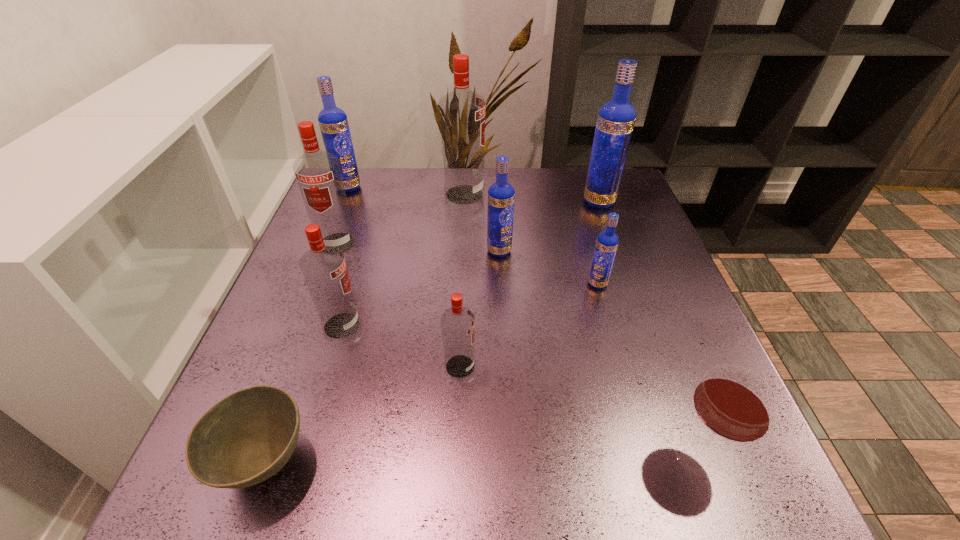
What are the coordinates of `the third nearest vodka` in the screenshot? It's located at (607, 242).

Where is `the nearest red vodka`? This screenshot has width=960, height=540. the nearest red vodka is located at coordinates (457, 322).

Locate an element on the screen. This screenshot has width=960, height=540. the smallest red vodka is located at coordinates (457, 322).

You are a GUI agent. You are given a task and a screenshot of the screen. Output one action in this format:
    pyautogui.click(x=<x>, y=<y>)
    Task: Click on the wineglass
    The width and height of the screenshot is (960, 540).
    Given the screenshot: What is the action you would take?
    pyautogui.click(x=734, y=403)

Where is `the shortest object`? the shortest object is located at coordinates (247, 437).

The width and height of the screenshot is (960, 540). I want to click on free location located 0.130m on the front label of the farthest red vodka, so click(x=532, y=194).

Where is `free location located 0.140m on the back of the biggest blue vodka`? The height and width of the screenshot is (540, 960). free location located 0.140m on the back of the biggest blue vodka is located at coordinates (587, 168).

Find the location of a particular element. Image resolution: width=960 pixels, height=540 pixels. vacant point located 0.390m on the front of the second biggest blue vodka is located at coordinates (304, 294).

The image size is (960, 540). In order to click on free region located on the front label of the third nearest red vodka in this screenshot , I will do `click(318, 296)`.

The height and width of the screenshot is (540, 960). I want to click on vacant space located 0.100m on the back of the sixth vodka from left to right, so click(497, 219).